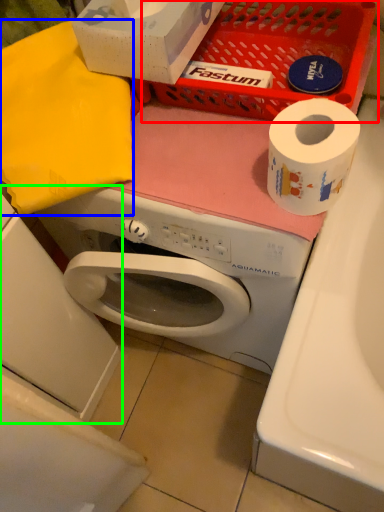
Question: Which is farther away from basket (highlighted by a red box)? clothe (highlighted by a blue box) or machine (highlighted by a green box)?

Choices:
 (A) clothe
 (B) machine

Answer: (B)